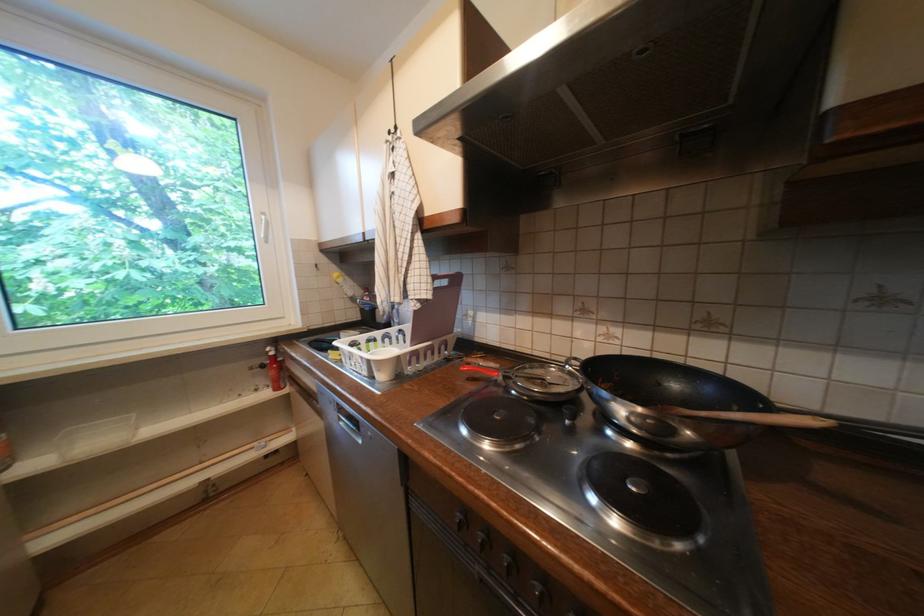
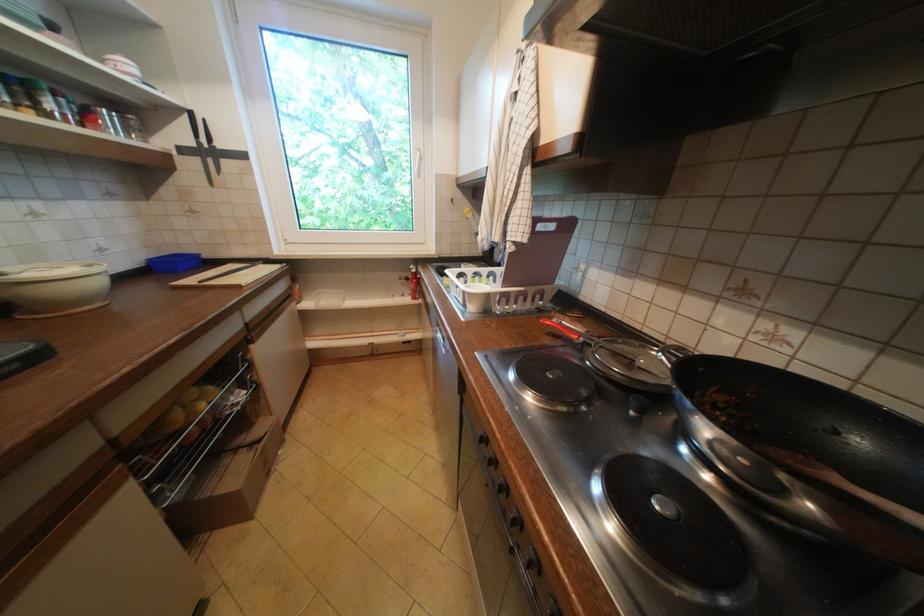
Where in the second image is the point corresponding to (264,391) from the first image?

(410, 296)